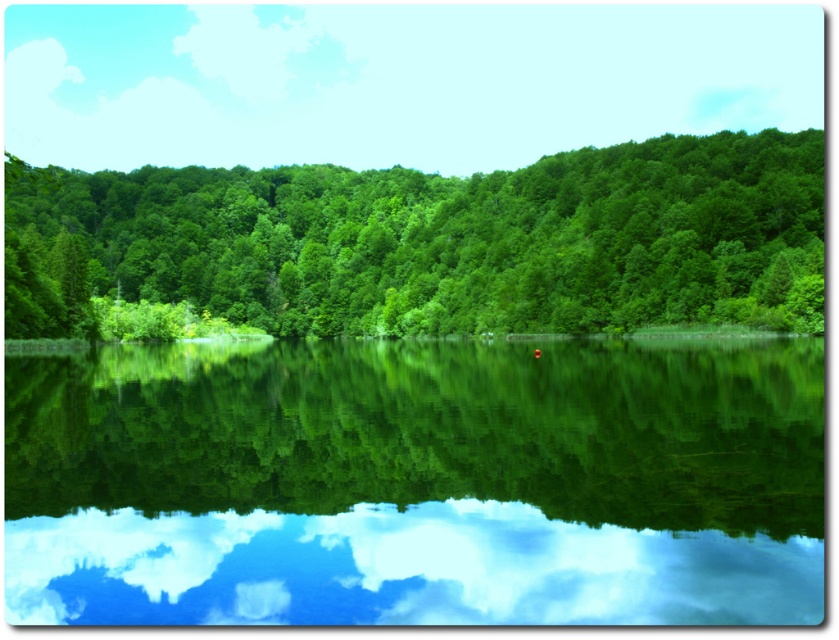
You are standing at the edge of the lake and want to take a photo of both the green reflective water at center and the green leafy trees at center. If your camera can focus on objects up to 300 feet away, will you need to adjust your focus to capture both subjects clearly?

The green reflective water at center is 330.78 feet away from green leafy trees at center. Since the camera can only focus up to 300 feet, you will need to adjust your focus to ensure both subjects are in clear view.

You are standing at the edge of the lake and notice the green reflective water at center and the green leafy trees at center. Which object is positioned to the right of the other?

The green reflective water at center is to the right of the green leafy trees at center.

You are an artist planning to paint the scene. You want to ensure the green reflective water at center and green leafy trees at center are proportionally accurate. Which object should you paint to take up more space on the canvas?

The green leafy trees at center should take up more space on the canvas because the green reflective water at center occupies less space than the green leafy trees at center according to the description.